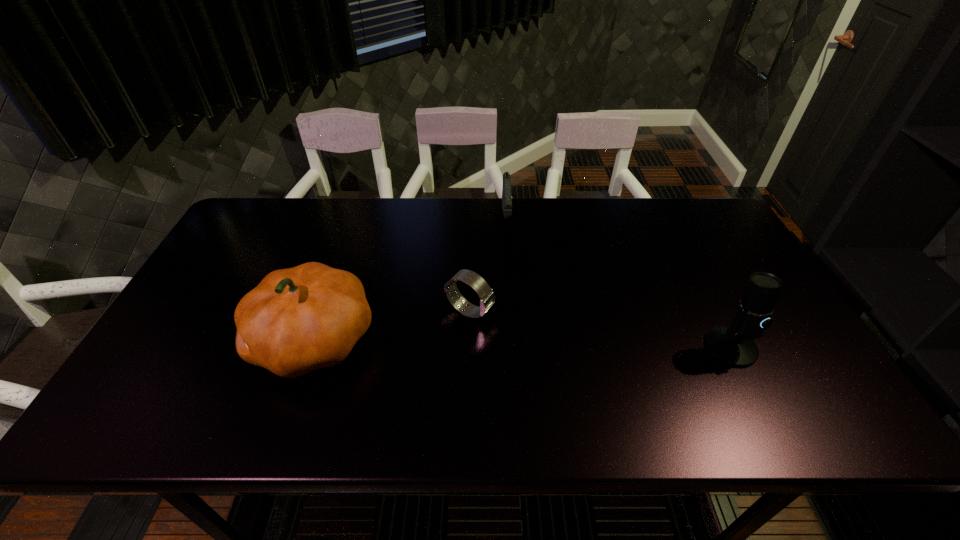
Identify the location of free spot on the desktop that is between the leftmost object and the microphone and is positioned on the face of the third object from right to left. (536, 344).

The image size is (960, 540). Find the location of `vacant spot on the desktop that is between the pumpkin and the rightmost object and is positioned at the barrel of the second object from right to left`. vacant spot on the desktop that is between the pumpkin and the rightmost object and is positioned at the barrel of the second object from right to left is located at coordinates (512, 343).